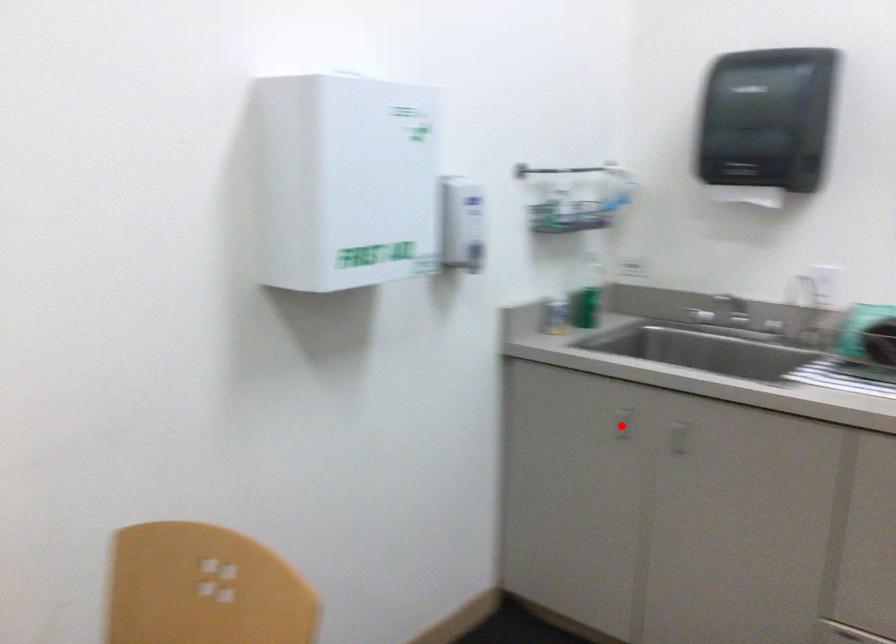
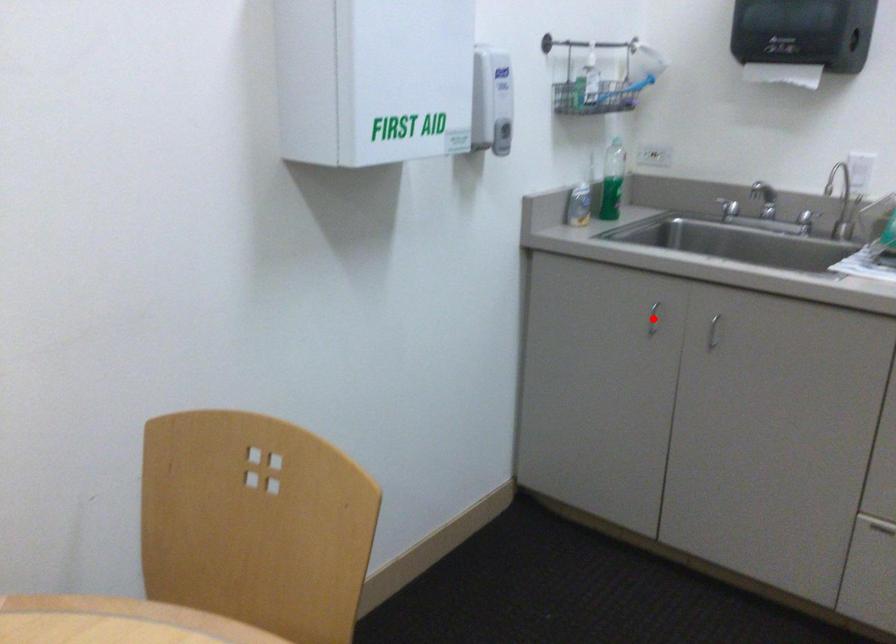
I am providing you with two images of the same scene from different viewpoints. A red point is marked on the first image and another point is marked on the second image. Does the point marked in image1 correspond to the same location as the one in image2?

Yes